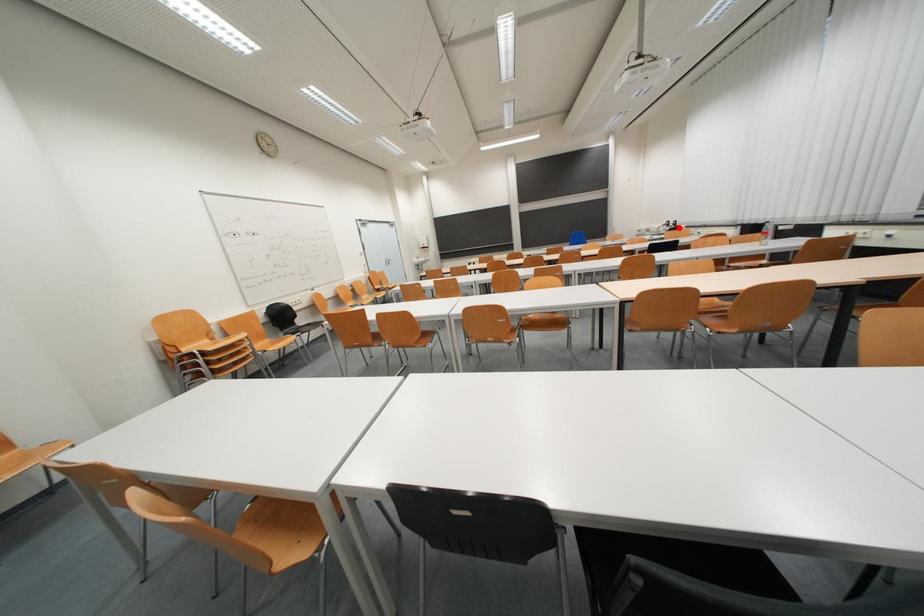
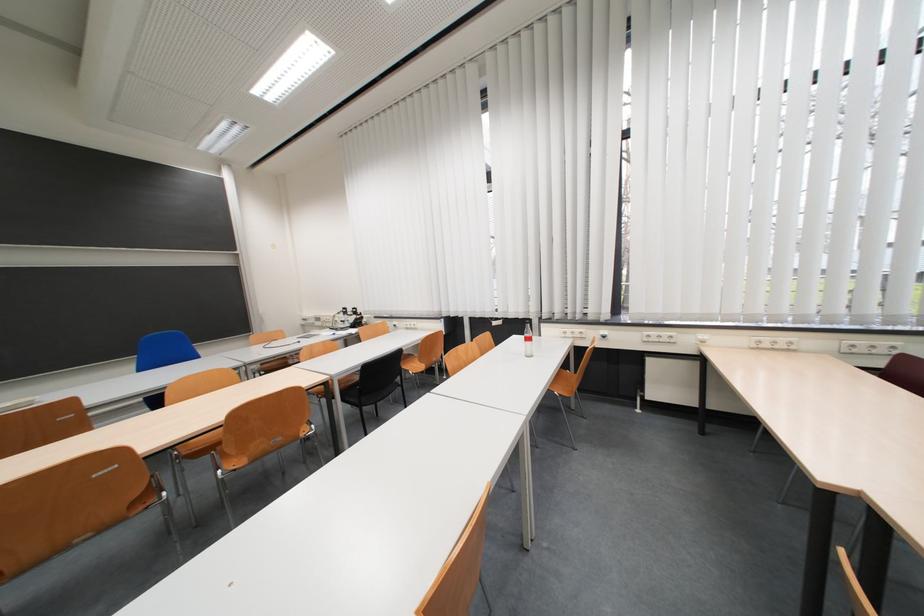
The point at the highlighted location is marked in the first image. Where is the corresponding point in the second image?

(357, 315)